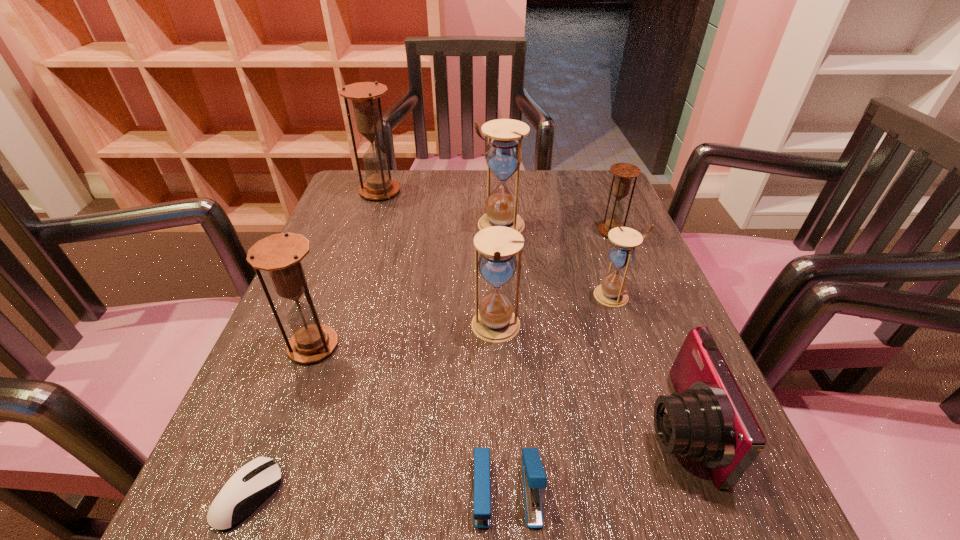
Locate an element on the screen. The height and width of the screenshot is (540, 960). blue stapler is located at coordinates (534, 478).

The height and width of the screenshot is (540, 960). Identify the location of mouse. coord(255,481).

Find the location of `the shortest object`. the shortest object is located at coordinates (255, 481).

This screenshot has width=960, height=540. I want to click on vacant space located on the right of the farthest brown hourglass, so click(521, 192).

Where is `vacant region located on the left of the farthest white hourglass`? This screenshot has width=960, height=540. vacant region located on the left of the farthest white hourglass is located at coordinates (417, 225).

Identify the location of vacant space situated 0.290m on the left of the second biggest white hourglass. The height and width of the screenshot is (540, 960). (312, 328).

This screenshot has width=960, height=540. In order to click on vacant region located on the back of the second biggest brown hourglass in this screenshot , I will do `click(348, 253)`.

I want to click on vacant space located on the back of the second farthest brown hourglass, so click(x=602, y=208).

At what (x,y) coordinates should I click in order to perform the action: click on vacant space located 0.240m on the back of the rightmost white hourglass. Please return your answer as a coordinate pair (x, y). This screenshot has width=960, height=540. Looking at the image, I should click on (588, 218).

You are a GUI agent. You are given a task and a screenshot of the screen. Output one action in this format:
    pyautogui.click(x=<x>, y=<y>)
    Task: Click on the vacant region located 0.230m on the front-facing side of the seventh tallest object
    This screenshot has height=540, width=960.
    Given the screenshot: What is the action you would take?
    pyautogui.click(x=490, y=426)